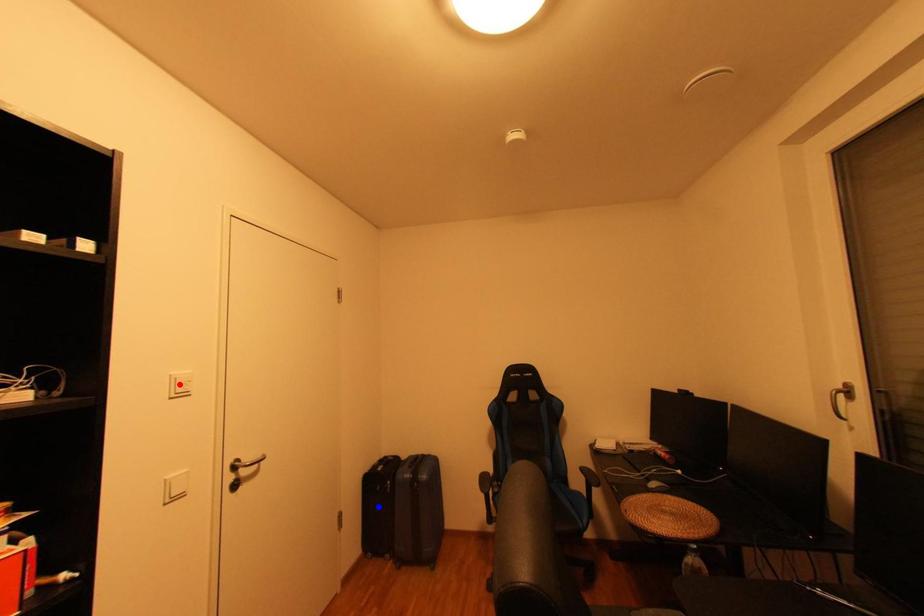
Question: In the image, two points are highlighted. Which point is nearer to the camera? Reply with the corresponding letter.

Choices:
 (A) blue point
 (B) red point

Answer: (B)